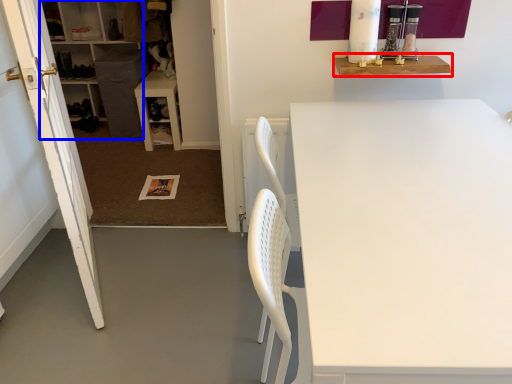
Question: Which object appears farthest to the camera in this image, shelf (highlighted by a red box) or cabinetry (highlighted by a blue box)?

Choices:
 (A) shelf
 (B) cabinetry

Answer: (B)